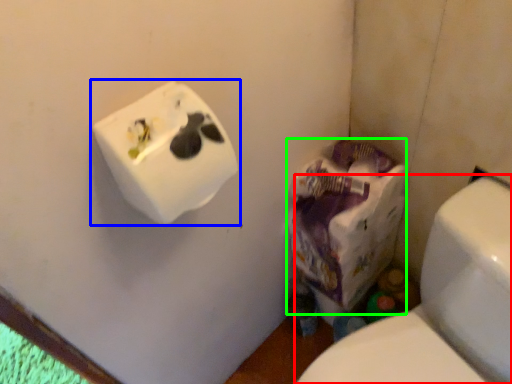
Question: Which object is the closest to the toilet (highlighted by a red box)? Choose among these: toilet paper (highlighted by a blue box) or paper bag (highlighted by a green box).

Choices:
 (A) toilet paper
 (B) paper bag

Answer: (B)